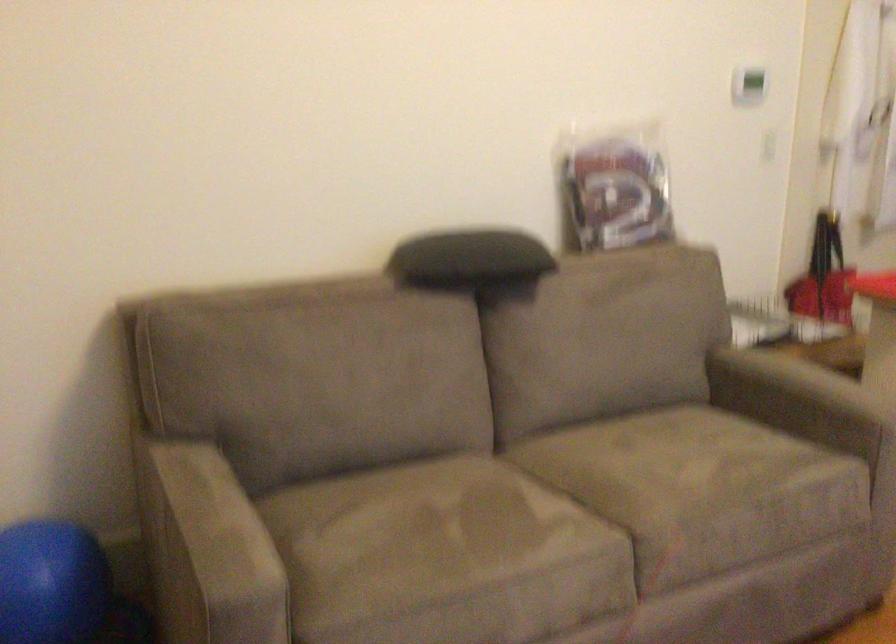
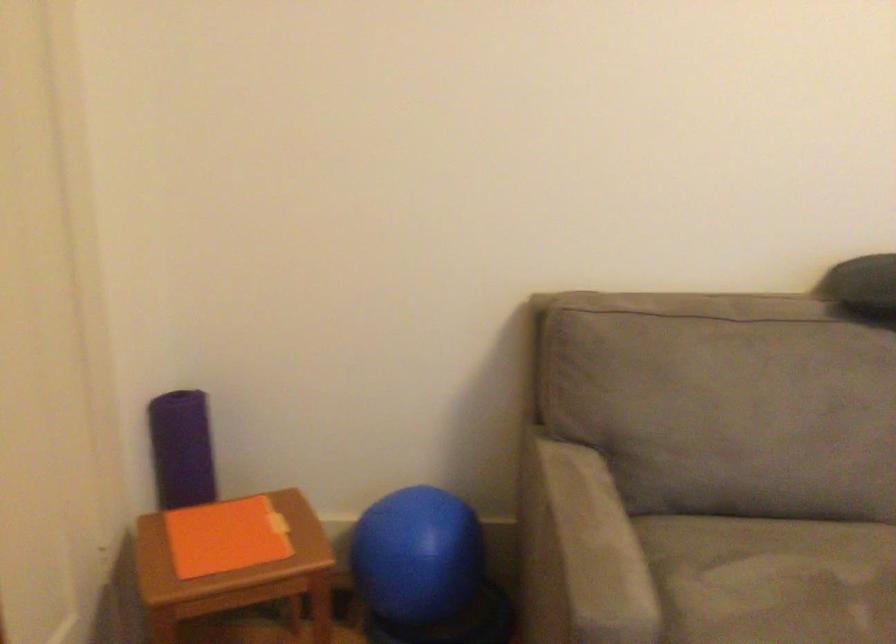
Locate, in the second image, the point that corresponds to point (381, 524) in the first image.

(771, 579)